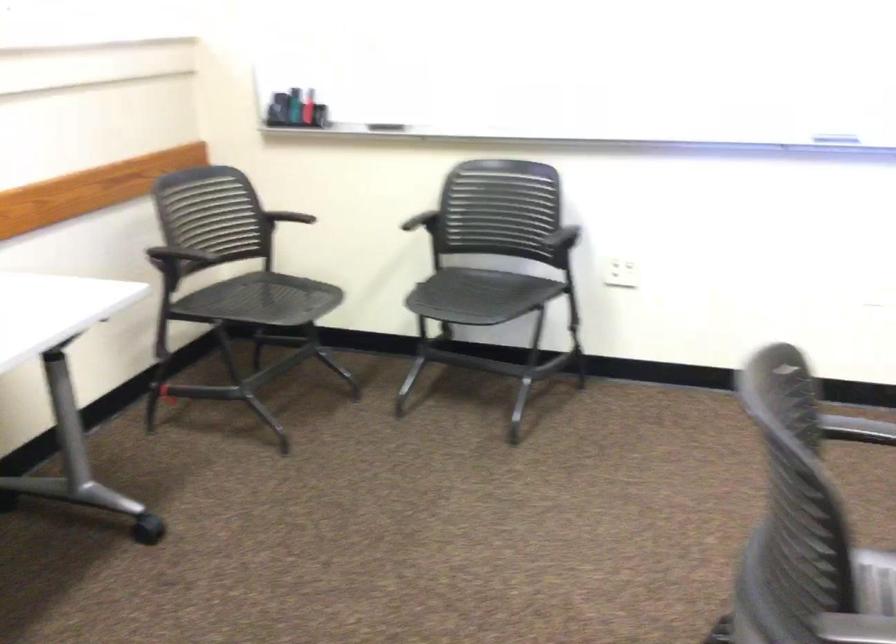
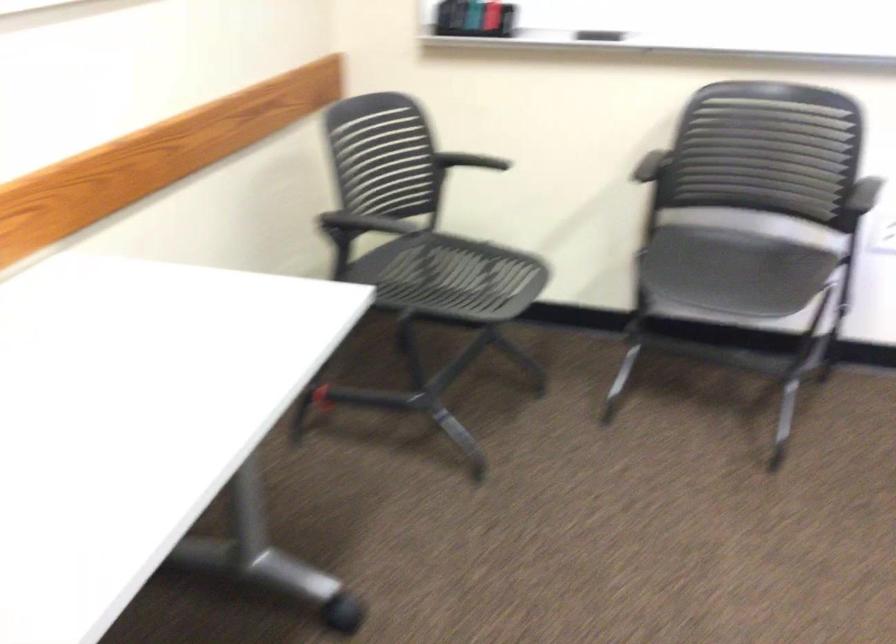
Locate, in the second image, the point that corresponds to point 556,234 in the first image.

(865, 194)